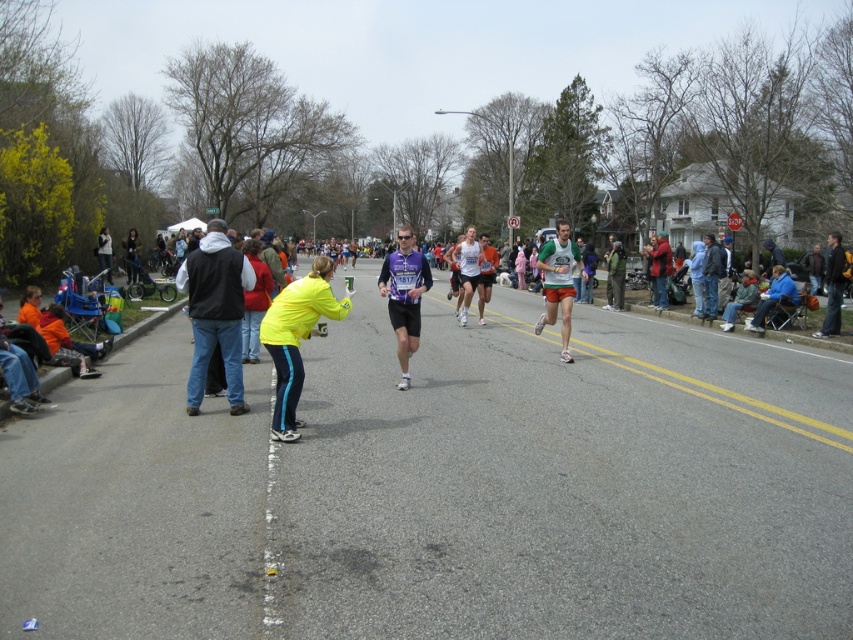
Question: Is the position of neon yellow jacket at lower left more distant than that of yellow fabric jacket at center?

Choices:
 (A) yes
 (B) no

Answer: (B)

Question: Can you confirm if neon yellow jacket at lower left is positioned to the right of green fabric shorts at center?

Choices:
 (A) yes
 (B) no

Answer: (B)

Question: Can you confirm if neon yellow jacket at lower left is positioned to the right of purple fabric shirt at center?

Choices:
 (A) no
 (B) yes

Answer: (A)

Question: Which object is the closest to the black vest at center?

Choices:
 (A) green fabric shorts at center
 (B) purple fabric shirt at center
 (C) yellow fabric jacket at center
 (D) matte black jacket at center

Answer: (B)

Question: Which object is farther from the camera taking this photo?

Choices:
 (A) matte black jacket at center
 (B) black vest at center
 (C) green fabric shorts at center
 (D) yellow fabric jacket at center

Answer: (D)

Question: Which point is farther to the camera?

Choices:
 (A) (109, 282)
 (B) (569, 280)
 (C) (129, 243)

Answer: (C)